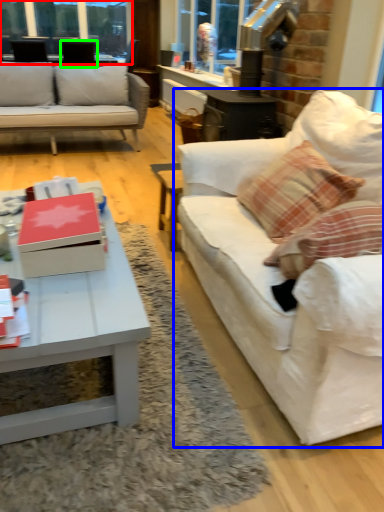
Question: Estimate the real-world distances between objects in this image. Which object is farther from window frame (highlighted by a red box), studio couch (highlighted by a blue box) or armchair (highlighted by a green box)?

Choices:
 (A) studio couch
 (B) armchair

Answer: (A)